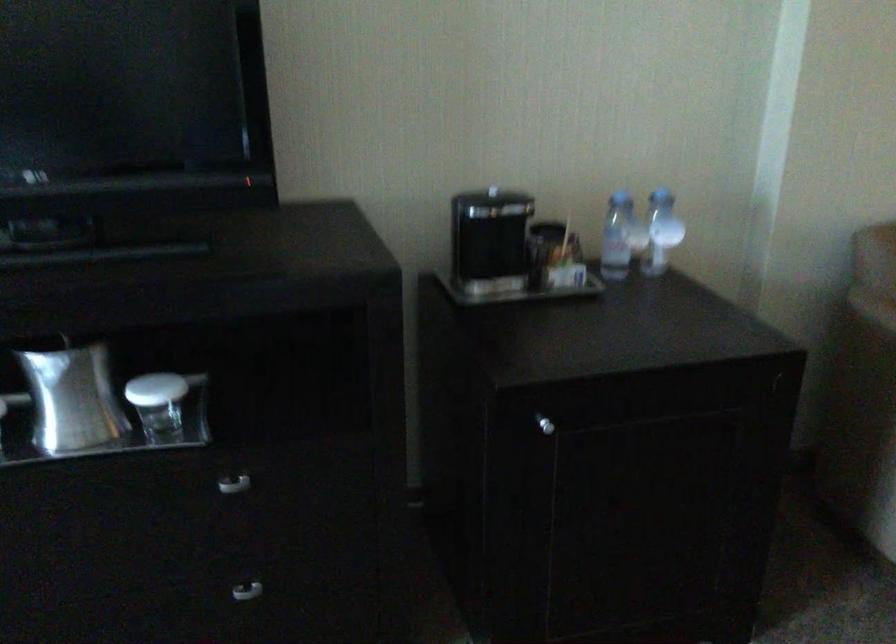
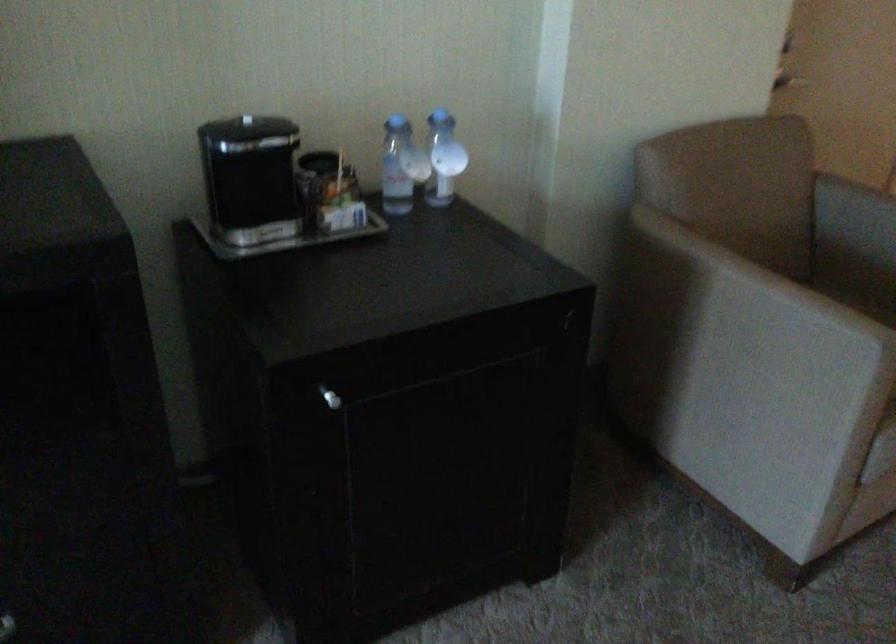
Locate, in the second image, the point that corresponds to (660,227) in the first image.

(443, 158)